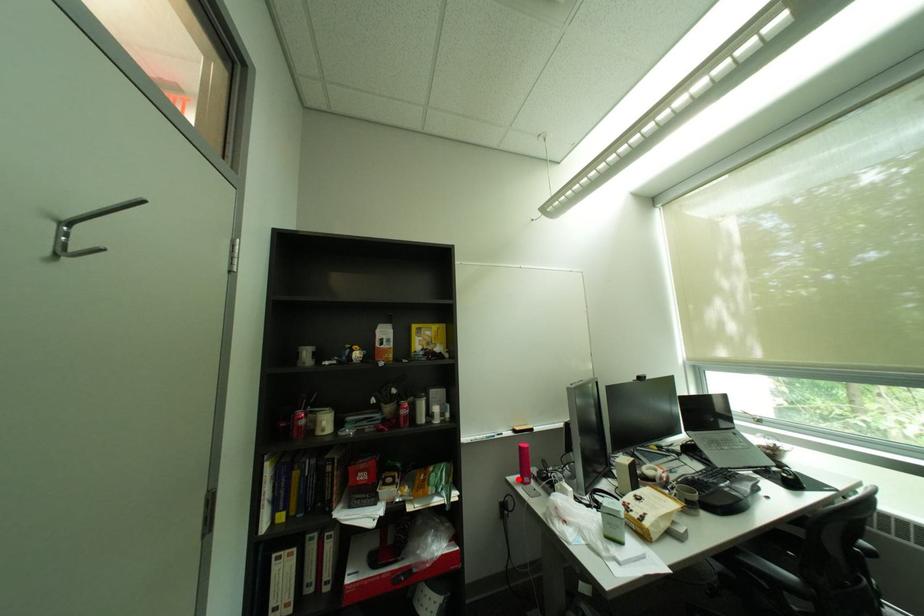
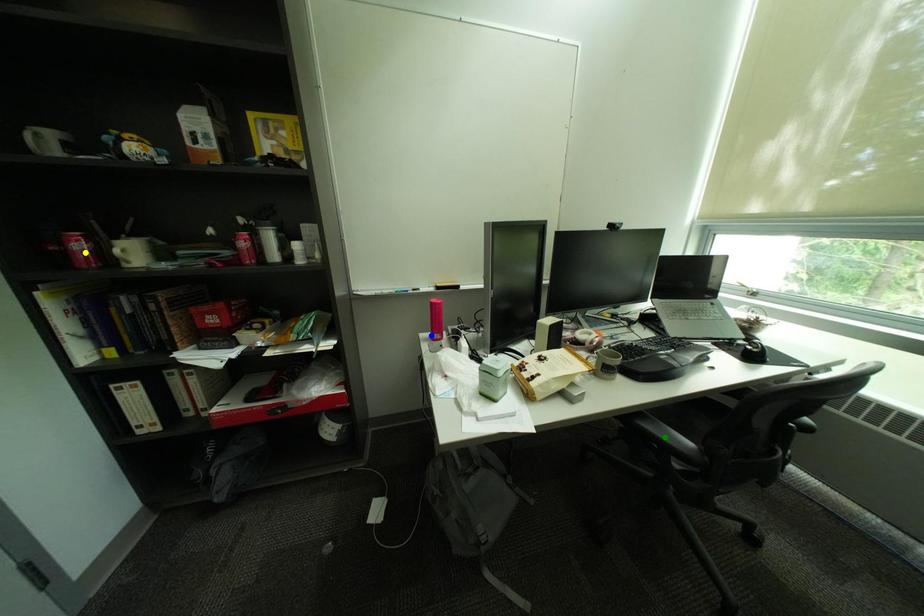
Question: I am providing you with two images of the same scene from different viewpoints. A red point is marked on the first image. You are given multiple points on the second image. Which spot in image 2 lines up with the point in image 1?

Choices:
 (A) green point
 (B) yellow point
 (C) blue point

Answer: (C)